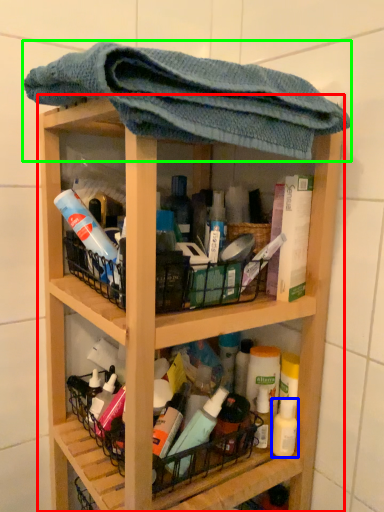
Question: Which is farther away from shelf (highlighted by a red box)? mouthwash (highlighted by a blue box) or towel (highlighted by a green box)?

Choices:
 (A) mouthwash
 (B) towel

Answer: (A)